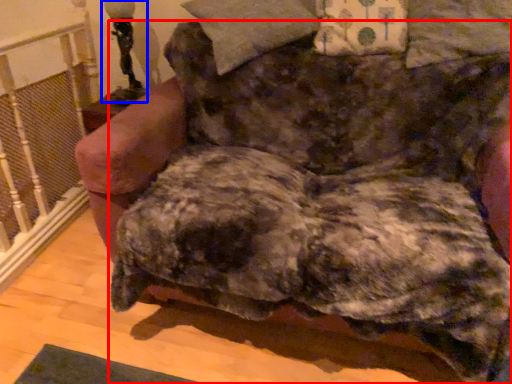
Question: Which object is closer to the camera taking this photo, dog (highlighted by a red box) or table lamp (highlighted by a blue box)?

Choices:
 (A) dog
 (B) table lamp

Answer: (A)